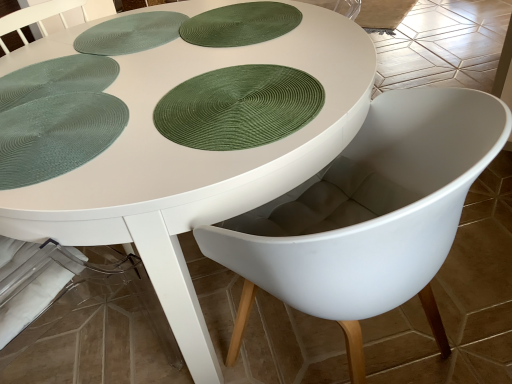
Question: Is white matte table at center to the right of green textured placemat at upper left, which appears as the 3th paper plate when ordered from the bottom, from the viewer's perspective?

Choices:
 (A) yes
 (B) no

Answer: (A)

Question: Is white matte table at center closer to the viewer compared to green textured placemat at upper left, the 2th paper plate when ordered from top to bottom?

Choices:
 (A) yes
 (B) no

Answer: (A)

Question: Can you confirm if white matte table at center is positioned to the left of green textured placemat at upper left, which appears as the 3th paper plate when ordered from the bottom?

Choices:
 (A) yes
 (B) no

Answer: (B)

Question: Can you confirm if white matte table at center is thinner than green textured placemat at upper left, which appears as the 3th paper plate when ordered from the bottom?

Choices:
 (A) no
 (B) yes

Answer: (A)

Question: Does white matte table at center have a larger size compared to green textured placemat at upper left, the 2th paper plate when ordered from top to bottom?

Choices:
 (A) no
 (B) yes

Answer: (B)

Question: Is white matte table at center inside or outside of white matte poker table at center?

Choices:
 (A) outside
 (B) inside

Answer: (A)

Question: In the image, is white matte table at center positioned in front of or behind white matte poker table at center?

Choices:
 (A) behind
 (B) front

Answer: (B)

Question: In terms of width, does white matte table at center look wider or thinner when compared to white matte poker table at center?

Choices:
 (A) thin
 (B) wide

Answer: (B)

Question: Is white matte table at center taller or shorter than white matte poker table at center?

Choices:
 (A) tall
 (B) short

Answer: (B)

Question: From the image's perspective, is green textured placemat at left, marked as the first paper plate in a bottom-to-top arrangement, above or below green textured placemat at upper left, which appears as the 3th paper plate when ordered from the bottom?

Choices:
 (A) below
 (B) above

Answer: (A)

Question: Does point (71, 119) appear closer or farther from the camera than point (11, 105)?

Choices:
 (A) closer
 (B) farther

Answer: (A)

Question: Would you say green textured placemat at left, marked as the fourth paper plate in a top-to-bottom arrangement, is inside or outside green textured placemat at upper left, the 2th paper plate when ordered from top to bottom?

Choices:
 (A) inside
 (B) outside

Answer: (B)

Question: Considering the positions of green textured placemat at left, marked as the first paper plate in a bottom-to-top arrangement, and green textured placemat at upper left, which appears as the 3th paper plate when ordered from the bottom, in the image, is green textured placemat at left, marked as the first paper plate in a bottom-to-top arrangement, wider or thinner than green textured placemat at upper left, which appears as the 3th paper plate when ordered from the bottom,?

Choices:
 (A) wide
 (B) thin

Answer: (B)

Question: From a real-world perspective, is white matte poker table at center physically located above or below green textured placemat at left, marked as the fourth paper plate in a top-to-bottom arrangement?

Choices:
 (A) above
 (B) below

Answer: (B)

Question: Relative to green textured placemat at left, marked as the fourth paper plate in a top-to-bottom arrangement, is white matte poker table at center in front or behind?

Choices:
 (A) front
 (B) behind

Answer: (B)